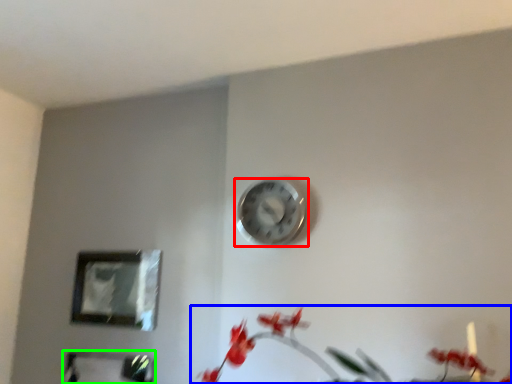
Question: Based on their relative distances, which object is farther from wall clock (highlighted by a red box)? Choose from floral arrangement (highlighted by a blue box) and picture frame (highlighted by a green box).

Choices:
 (A) floral arrangement
 (B) picture frame

Answer: (B)